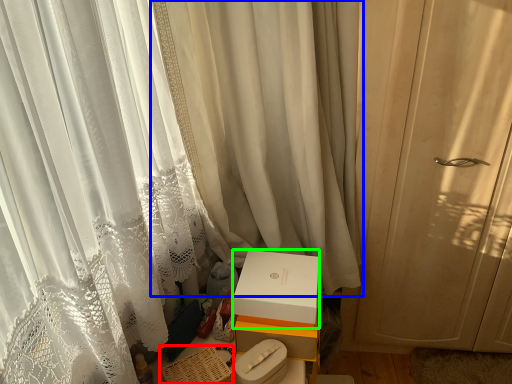
Question: Which is nearer to the basket (highlighted by a red box)? curtain (highlighted by a blue box) or box (highlighted by a green box).

Choices:
 (A) curtain
 (B) box

Answer: (B)